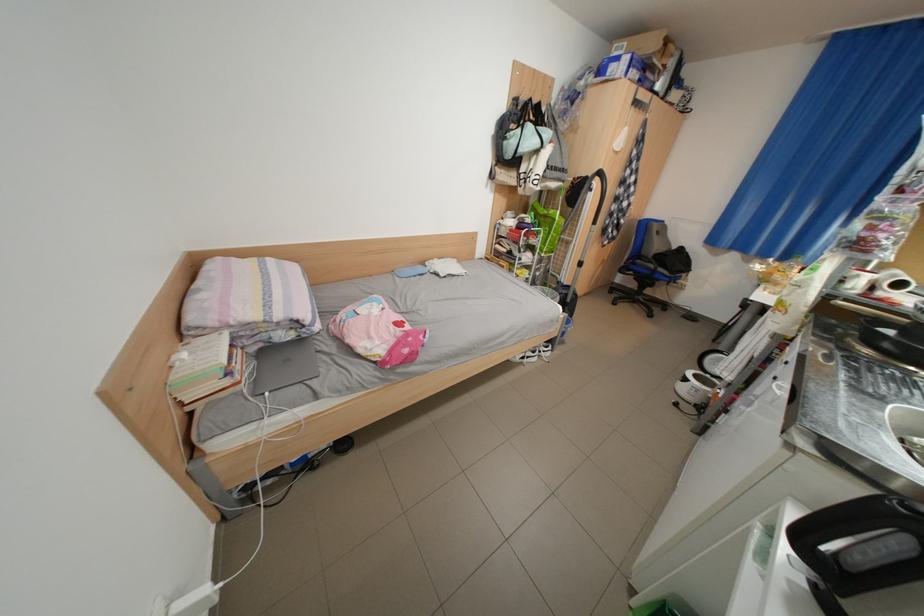
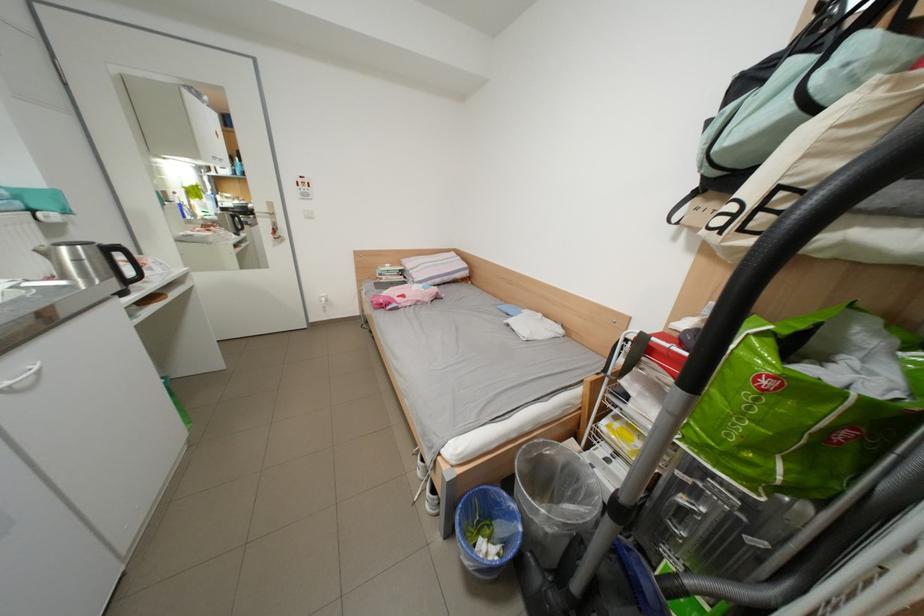
Where in the second image is the point corresponding to point (557, 188) from the first image?

(856, 245)